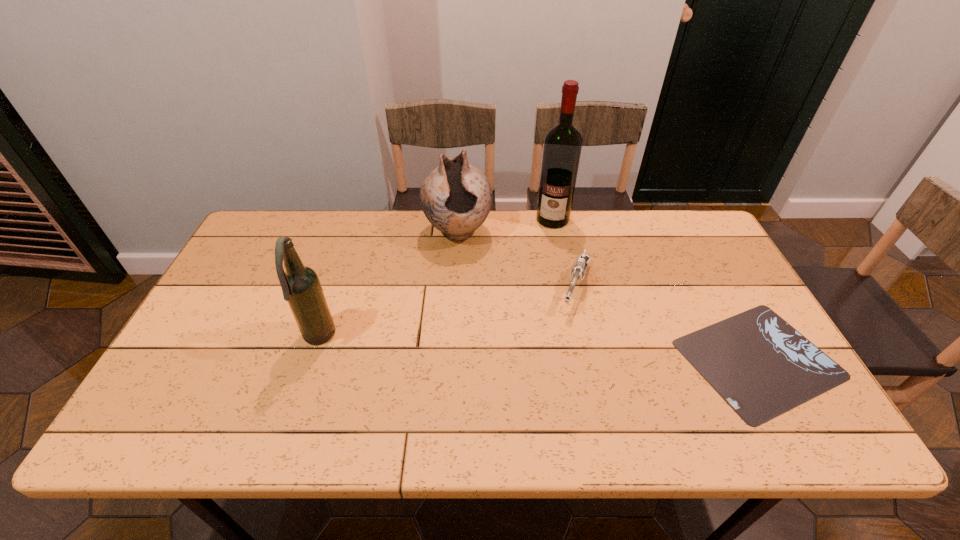
Where is `vacant spot on the desktop that is between the leftmost object and the mousepad and is positioned on the front and back of the alcohol`? Image resolution: width=960 pixels, height=540 pixels. vacant spot on the desktop that is between the leftmost object and the mousepad and is positioned on the front and back of the alcohol is located at coordinates (518, 348).

Image resolution: width=960 pixels, height=540 pixels. What are the coordinates of `vacant spot on the desktop that is between the leftmost object and the rightmost object and is positioned aimed along the barrel of the gun` in the screenshot? It's located at (553, 349).

The image size is (960, 540). What are the coordinates of `vacant space on the desktop that is between the beer bottle and the rightmost object and is positioned from the spout of the fourth object from right to left` in the screenshot? It's located at (476, 346).